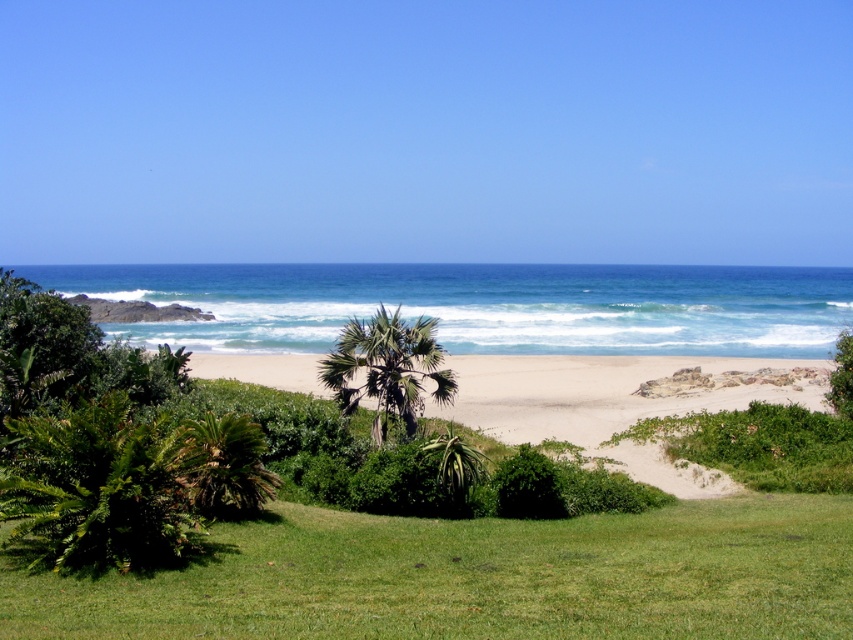
Is beige sand at center to the left of green leafy palm tree at center from the viewer's perspective?

No, beige sand at center is not to the left of green leafy palm tree at center.

Looking at this image, does beige sand at center lie behind green leafy palm tree at center?

That is False.

What do you see at coordinates (619, 403) in the screenshot?
I see `beige sand at center` at bounding box center [619, 403].

Identify the location of beige sand at center. (619, 403).

Consider the image. Does green grassy at lower center have a larger size compared to green leafy palm tree at center?

Yes, green grassy at lower center is bigger than green leafy palm tree at center.

Is point (624, 541) farther from viewer compared to point (425, 348)?

No, it is not.

What are the coordinates of `green grassy at lower center` in the screenshot? It's located at (476, 577).

At what (x,y) coordinates should I click in order to perform the action: click on green grassy at lower center. Please return your answer as a coordinate pair (x, y). The width and height of the screenshot is (853, 640). Looking at the image, I should click on (476, 577).

Does point (302, 545) lie in front of point (256, 472)?

That is True.

I want to click on green grassy at lower center, so click(476, 577).